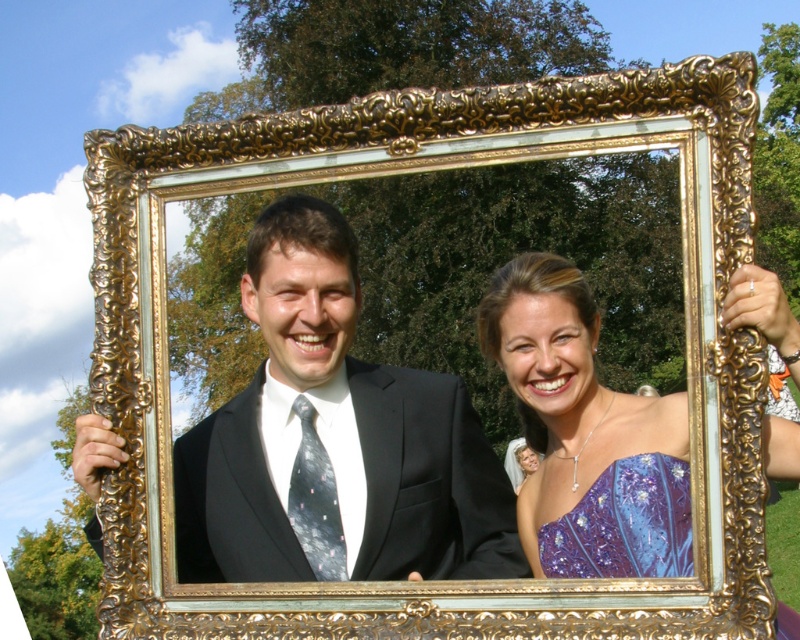
Between point (632, 516) and point (690, 552), which one is positioned in front?

Point (690, 552) is more forward.

The height and width of the screenshot is (640, 800). I want to click on shiny blue dress at center, so click(586, 435).

At what (x,y) coordinates should I click in order to perform the action: click on shiny blue dress at center. Please return your answer as a coordinate pair (x, y). The width and height of the screenshot is (800, 640). Looking at the image, I should click on (586, 435).

Which is in front, point (272, 552) or point (662, 566)?

Point (662, 566) is in front.

Does point (474, 525) come farther from viewer compared to point (641, 492)?

Yes.

I want to click on black satin suit at center, so click(x=336, y=440).

What are the coordinates of `black satin suit at center` in the screenshot? It's located at (336, 440).

Does black satin suit at center have a greater width compared to shiny blue dress at center?

Indeed, black satin suit at center has a greater width compared to shiny blue dress at center.

Who is shorter, black satin suit at center or shiny blue dress at center?

Standing shorter between the two is shiny blue dress at center.

Does point (260, 291) come behind point (524, 404)?

No.

At what (x,y) coordinates should I click in order to perform the action: click on black satin suit at center. Please return your answer as a coordinate pair (x, y). Looking at the image, I should click on (336, 440).